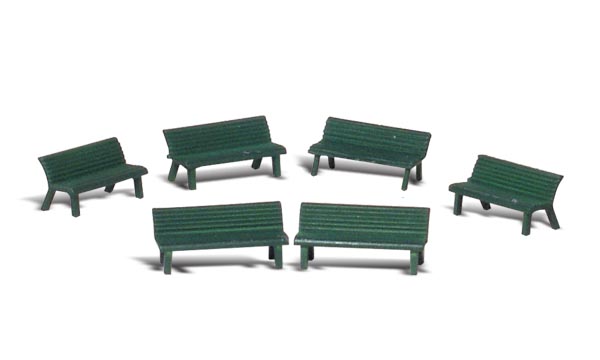
The image size is (600, 360). I want to click on miniture benches, so click(x=90, y=160), click(x=206, y=231), click(x=210, y=153), click(x=340, y=228), click(x=376, y=147), click(x=520, y=188).